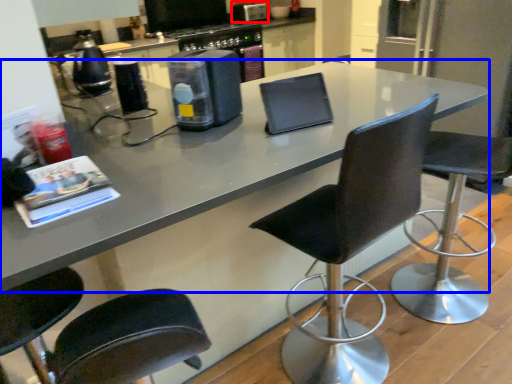
Question: Among these objects, which one is farthest to the camera, appliance (highlighted by a red box) or countertop (highlighted by a blue box)?

Choices:
 (A) appliance
 (B) countertop

Answer: (A)